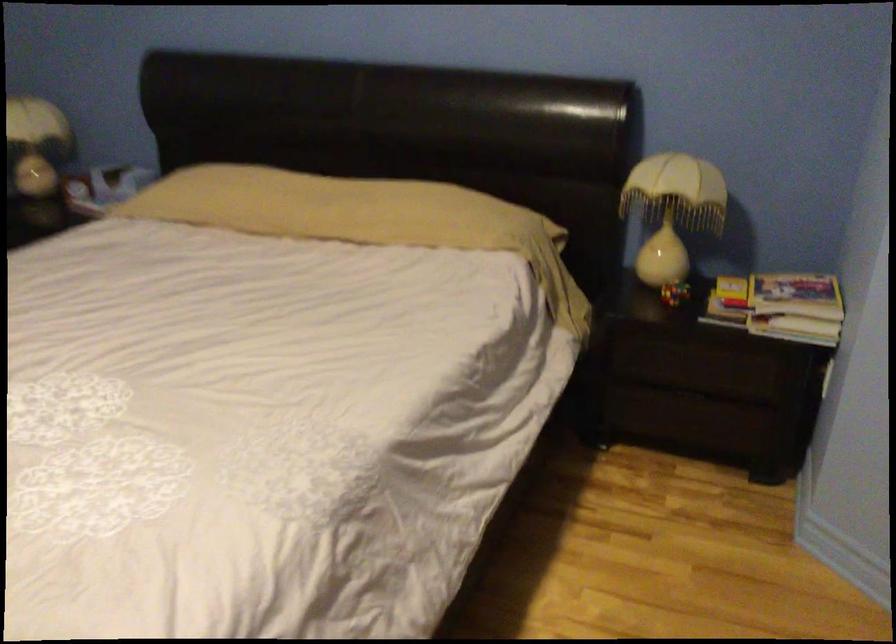
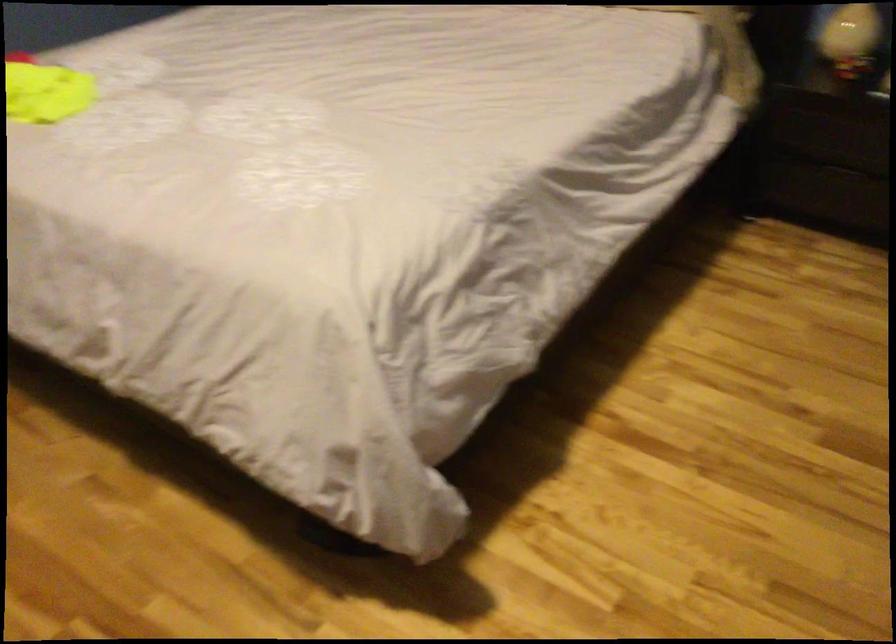
Locate, in the second image, the point that corresponds to (x=673, y=268) in the first image.

(851, 39)